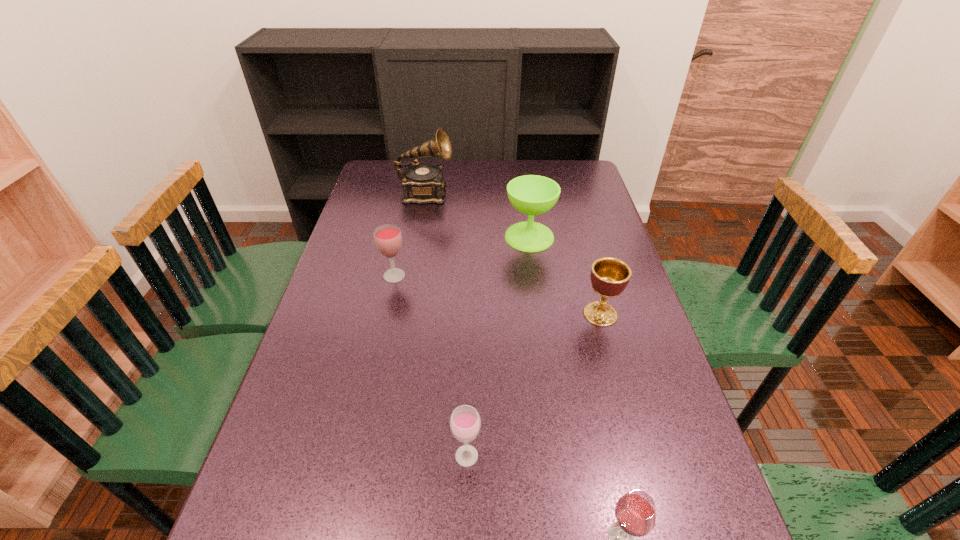
In the image, there is a desktop. What are the coordinates of `free space at the right edge` in the screenshot? It's located at (681, 443).

This screenshot has height=540, width=960. I want to click on vacant region at the far left corner of the desktop, so [396, 172].

Where is `free region at the far right corner of the desktop`? free region at the far right corner of the desktop is located at coordinates (576, 186).

Locate an element on the screen. Image resolution: width=960 pixels, height=540 pixels. empty location between the second farthest wineglass and the third farthest wineglass is located at coordinates (430, 366).

You are a GUI agent. You are given a task and a screenshot of the screen. Output one action in this format:
    pyautogui.click(x=<x>, y=<y>)
    Task: Click on the free point between the third wineglass from right to left and the third nearest object
    This screenshot has width=960, height=540.
    Given the screenshot: What is the action you would take?
    pyautogui.click(x=534, y=385)

Find the location of a particular element. free space between the third farthest object and the tallest object is located at coordinates (410, 235).

Locate an element on the screen. vacant space in between the fifth nearest object and the leftmost wineglass is located at coordinates (462, 256).

You are a GUI agent. You are given a task and a screenshot of the screen. Output one action in this format:
    pyautogui.click(x=<x>, y=<y>)
    Task: Click on the vacant space that's between the fourth nearest object and the phonograph record
    
    Given the screenshot: What is the action you would take?
    pyautogui.click(x=410, y=235)

Image resolution: width=960 pixels, height=540 pixels. What are the coordinates of `free space between the third nearest wineglass and the farthest object` in the screenshot? It's located at (410, 235).

Locate an element on the screen. This screenshot has height=540, width=960. object that is the second closest to the phonograph record is located at coordinates (388, 239).